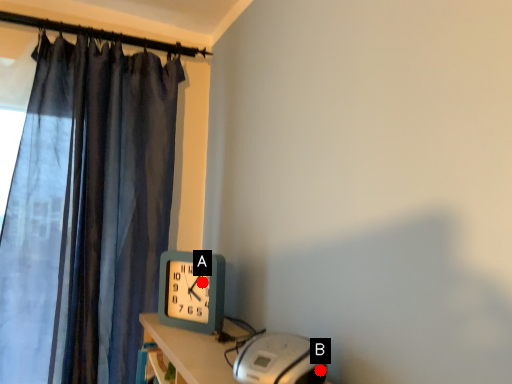
Question: Two points are circled on the image, labeled by A and B beside each circle. Which of the following is the closest to the observer?

Choices:
 (A) A is closer
 (B) B is closer

Answer: (B)